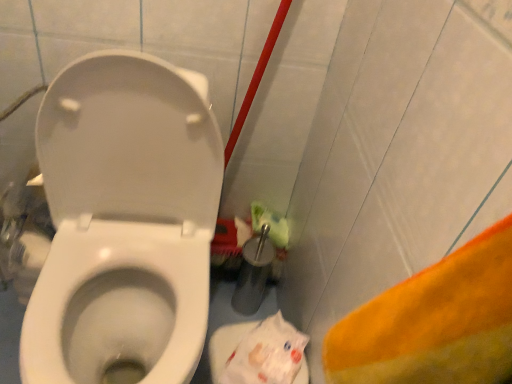
Question: From a real-world perspective, is white glossy toilet at center positioned above or below white plastic bag at lower right?

Choices:
 (A) above
 (B) below

Answer: (A)

Question: Considering the positions of white glossy toilet at center and white plastic bag at lower right in the image, is white glossy toilet at center bigger or smaller than white plastic bag at lower right?

Choices:
 (A) small
 (B) big

Answer: (B)

Question: Based on their positions, is white glossy toilet at center located to the left or right of white plastic bag at lower right?

Choices:
 (A) left
 (B) right

Answer: (A)

Question: Is white plastic bag at lower right situated inside white glossy toilet at center or outside?

Choices:
 (A) inside
 (B) outside

Answer: (B)

Question: From the image's perspective, relative to white glossy toilet at center, is white plastic bag at lower right above or below?

Choices:
 (A) below
 (B) above

Answer: (A)

Question: From a real-world perspective, is white plastic bag at lower right physically located above or below white glossy toilet at center?

Choices:
 (A) above
 (B) below

Answer: (B)

Question: In the image, is white plastic bag at lower right on the left side or the right side of white glossy toilet at center?

Choices:
 (A) right
 (B) left

Answer: (A)